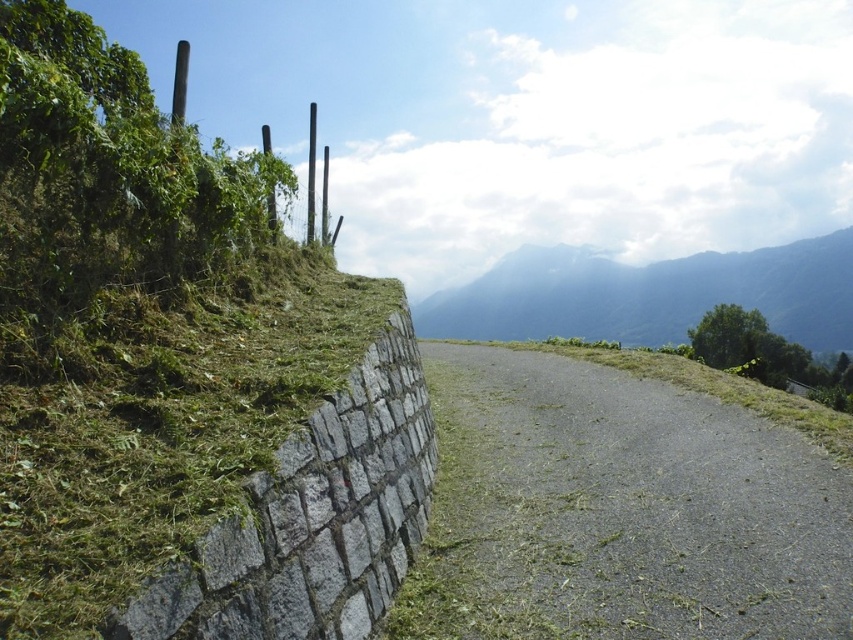
Question: Which object is the farthest from the green textured mountain at upper center?

Choices:
 (A) gray asphalt road at center
 (B) smooth gray pole at upper center

Answer: (A)

Question: Does gray asphalt road at center have a lesser width compared to green textured mountain at upper center?

Choices:
 (A) no
 (B) yes

Answer: (B)

Question: Does gray asphalt road at center appear on the right side of green textured mountain at upper center?

Choices:
 (A) no
 (B) yes

Answer: (A)

Question: Can you confirm if gray asphalt road at center is positioned below smooth gray pole at upper center?

Choices:
 (A) no
 (B) yes

Answer: (B)

Question: Which object is the closest to the smooth gray pole at upper center?

Choices:
 (A) green textured mountain at upper center
 (B) gray asphalt road at center

Answer: (B)

Question: Which point is closer to the camera?

Choices:
 (A) (310, 189)
 (B) (810, 616)
 (C) (519, 289)

Answer: (B)